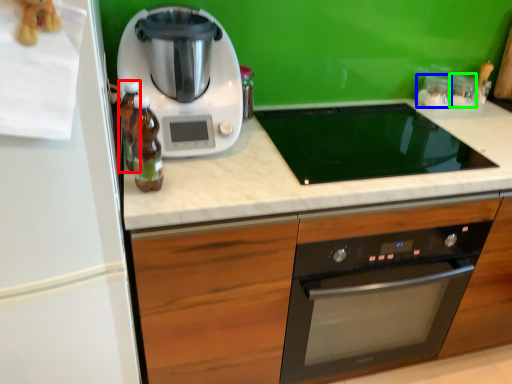
Question: Estimate the real-world distances between objects in this image. Which object is closer to bottle (highlighted by a red box), appliance (highlighted by a blue box) or appliance (highlighted by a green box)?

Choices:
 (A) appliance
 (B) appliance

Answer: (A)